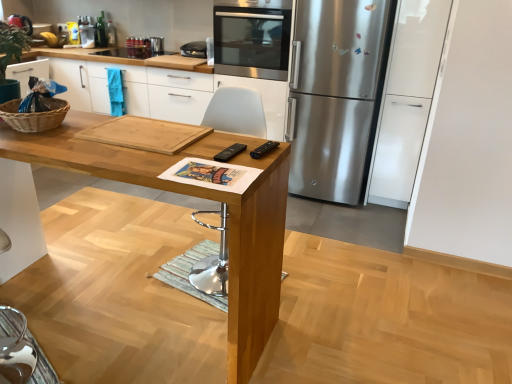
You are a GUI agent. You are given a task and a screenshot of the screen. Output one action in this format:
    pyautogui.click(x=<x>, y=<y>)
    Task: Click on the vacant region to the right of woven brown basket at left
    
    Given the screenshot: What is the action you would take?
    pyautogui.click(x=85, y=129)